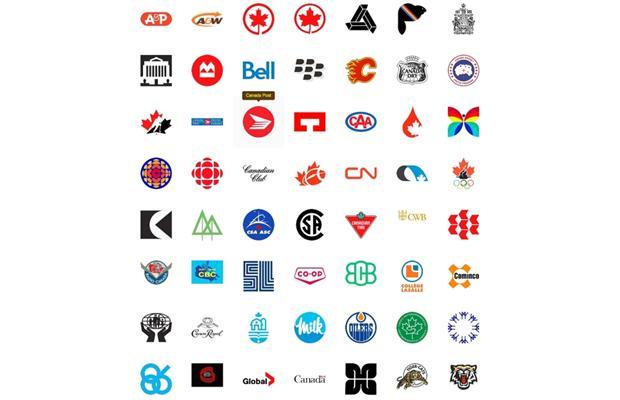
The width and height of the screenshot is (620, 400). I want to click on middle column, so click(308, 20), click(308, 66), click(316, 122), click(312, 174), click(310, 217), click(312, 284), click(304, 326), click(310, 381).